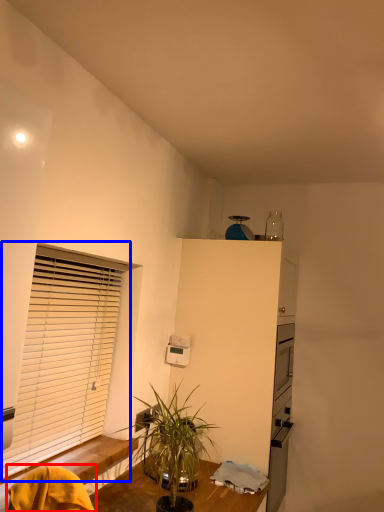
Question: Which of the following is the farthest to the observer, swivel chair (highlighted by a red box) or window blind (highlighted by a blue box)?

Choices:
 (A) swivel chair
 (B) window blind

Answer: (B)